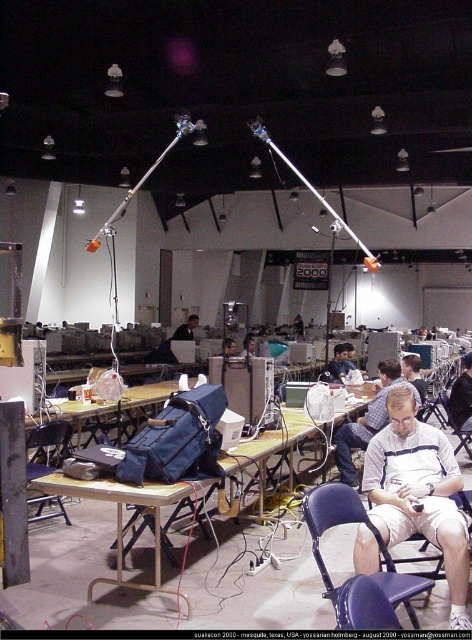
Who is more distant from viewer, (367, 547) or (380, 364)?

The point (380, 364) is more distant.

Is point (381, 433) in front of point (394, 369)?

Yes, point (381, 433) is in front of point (394, 369).

Is point (378, 497) positioned before point (346, 477)?

Yes, it is.

You are a GUI agent. You are given a task and a screenshot of the screen. Output one action in this format:
    pyautogui.click(x=<x>, y=<y>)
    Task: Click on the white striped shirt at center
    The height and width of the screenshot is (640, 472).
    Given the screenshot: What is the action you would take?
    pyautogui.click(x=419, y=492)

Does metallic silver table at center have a greater height compared to matte black chair at lower left?

Yes, metallic silver table at center is taller than matte black chair at lower left.

Can you confirm if metallic silver table at center is thinner than matte black chair at lower left?

Incorrect, metallic silver table at center's width is not less than matte black chair at lower left's.

Does point (138, 506) lie behind point (40, 461)?

No, it is in front of (40, 461).

Identify the location of metallic silver table at center. (123, 518).

Between white striped shirt at center and matte black chair at lower left, which one has less height?

matte black chair at lower left is shorter.

Is white striped shirt at center shorter than matte black chair at lower left?

No, white striped shirt at center is not shorter than matte black chair at lower left.

Who is more distant from viewer, (404, 428) or (27, 438)?

The point (27, 438) is behind.

Image resolution: width=472 pixels, height=640 pixels. I want to click on white striped shirt at center, so click(419, 492).